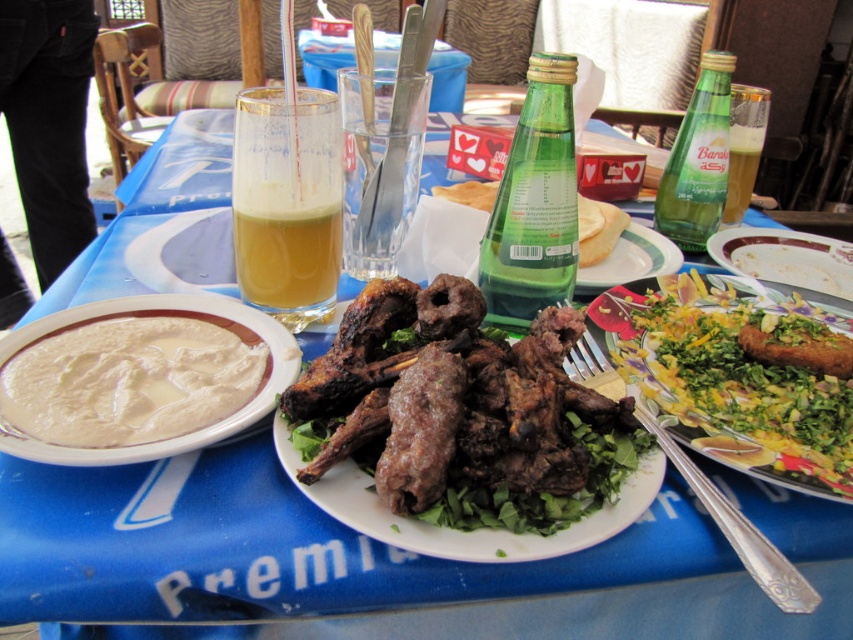
Does green leafy salad at center have a greater height compared to yellowish-green liquid at center?

No.

How much distance is there between green leafy salad at center and yellowish-green liquid at center?

Answer: green leafy salad at center and yellowish-green liquid at center are 9.55 inches apart.

Is point (827, 376) closer to camera compared to point (317, 184)?

That is True.

The image size is (853, 640). In order to click on green leafy salad at center in this screenshot , I will do `click(740, 372)`.

The image size is (853, 640). What do you see at coordinates (740, 372) in the screenshot? I see `green leafy salad at center` at bounding box center [740, 372].

Which is behind, point (830, 476) or point (134, 369)?

The point (134, 369) is behind.

You are a GUI agent. You are given a task and a screenshot of the screen. Output one action in this format:
    pyautogui.click(x=<x>, y=<y>)
    Task: Click on the green leafy salad at center
    This screenshot has width=853, height=640.
    Given the screenshot: What is the action you would take?
    pyautogui.click(x=740, y=372)

Does brown crispy meat at center have a lesser height compared to green glass bottle at upper right?

Indeed, brown crispy meat at center has a lesser height compared to green glass bottle at upper right.

Between brown crispy meat at center and green glass bottle at upper right, which one has less height?

brown crispy meat at center

Is point (532, 340) positioned after point (692, 177)?

No, it is not.

The height and width of the screenshot is (640, 853). What are the coordinates of `brown crispy meat at center` in the screenshot? It's located at (457, 408).